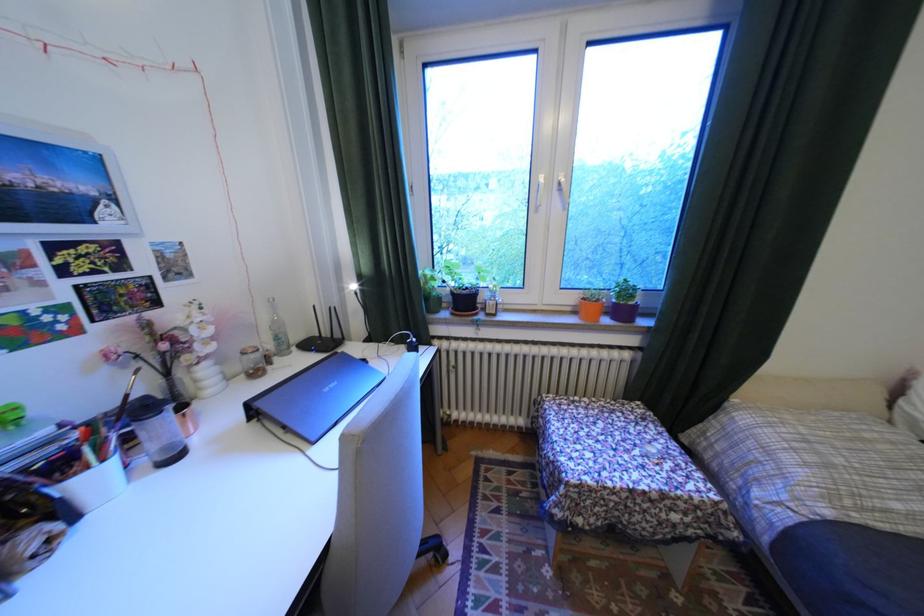
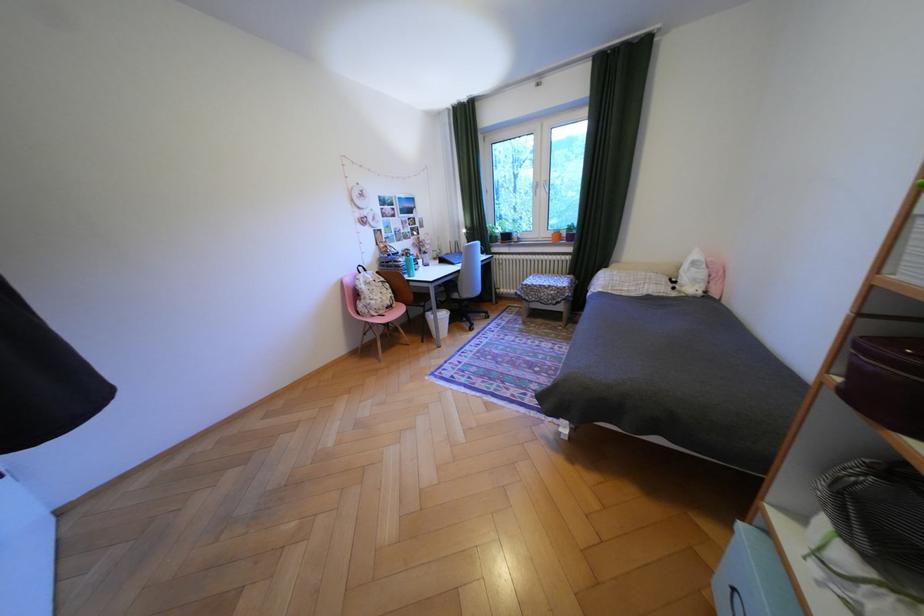
Find the pixel in the second image that matches point 675,496 in the first image.

(562, 286)